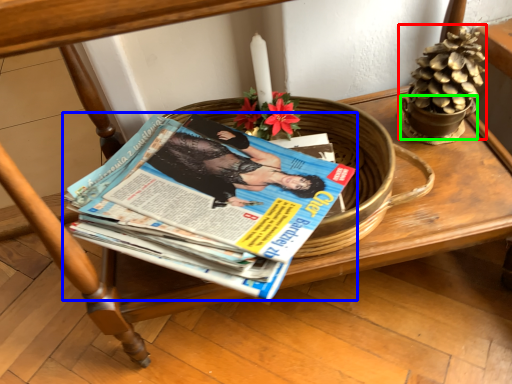
Question: Which object is the closest to the flower basket (highlighted by a red box)? Choose among these: book (highlighted by a blue box) or flowerpot (highlighted by a green box).

Choices:
 (A) book
 (B) flowerpot

Answer: (B)